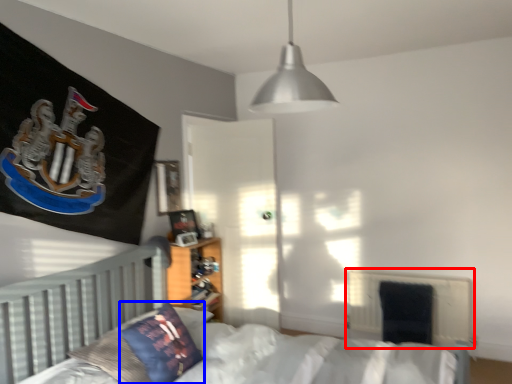
Question: Among these objects, which one is nearest to the camera, radiator (highlighted by a red box) or pillow (highlighted by a blue box)?

Choices:
 (A) radiator
 (B) pillow

Answer: (B)